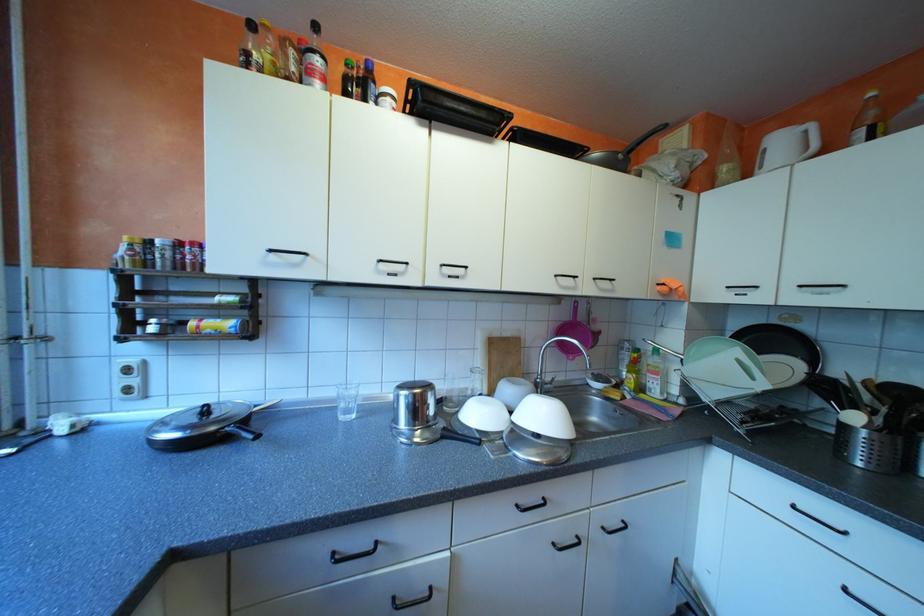
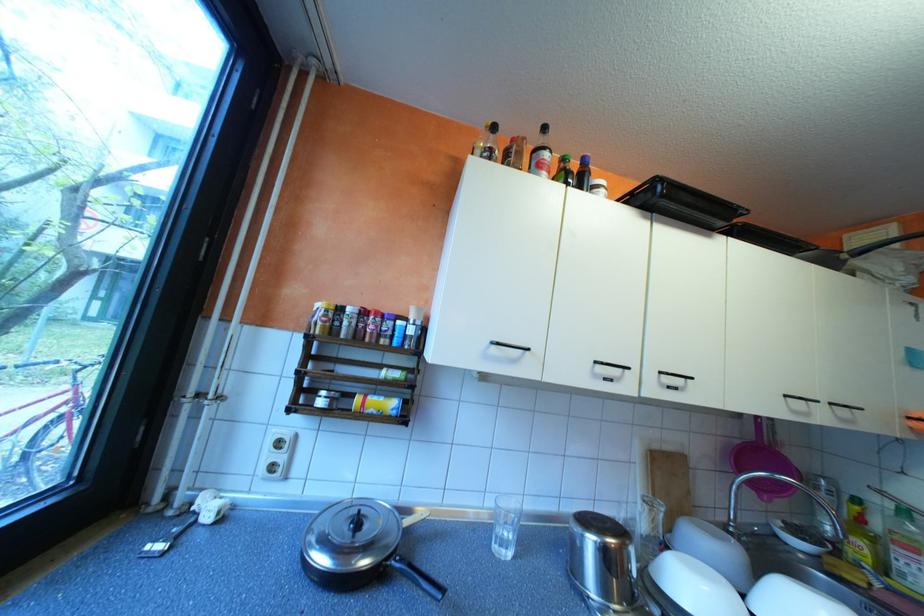
Where in the second image is the point corresponding to [359,411] from the first image?

(515, 541)